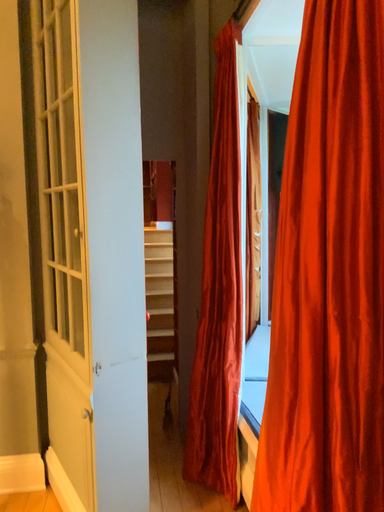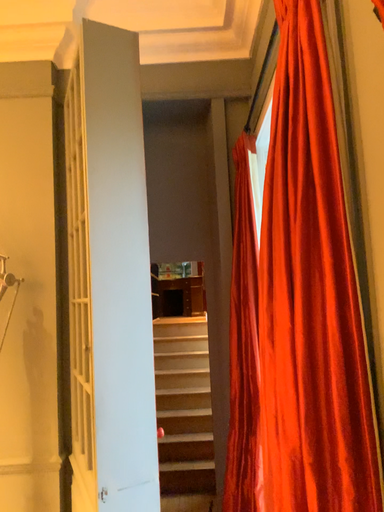
Question: Which way did the camera rotate in the video?

Choices:
 (A) rotated downward
 (B) rotated upward

Answer: (B)